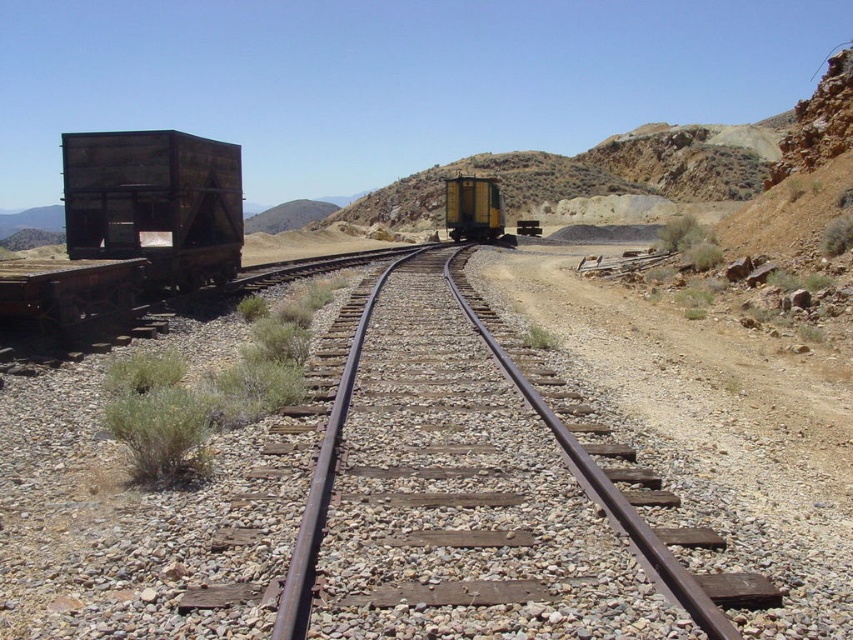
Consider the image. Is the position of weathered wood train car at left more distant than that of yellow matte train car at center?

No, it is not.

Between point (62, 296) and point (485, 228), which one is positioned behind?

The point (485, 228) is more distant.

This screenshot has width=853, height=640. In order to click on weathered wood train car at left in this screenshot , I will do `click(131, 228)`.

What do you see at coordinates (605, 490) in the screenshot? I see `rusty metal track at center` at bounding box center [605, 490].

Is rusty metal track at center positioned behind yellow matte train car at center?

That is False.

Is point (680, 593) positioned behind point (495, 195)?

No.

Where is `rusty metal track at center`? The width and height of the screenshot is (853, 640). rusty metal track at center is located at coordinates (605, 490).

Is weathered wood train car at left to the left of rusty metal track at center from the viewer's perspective?

Yes, weathered wood train car at left is to the left of rusty metal track at center.

The height and width of the screenshot is (640, 853). What do you see at coordinates (131, 228) in the screenshot? I see `weathered wood train car at left` at bounding box center [131, 228].

Which is in front, point (78, 296) or point (328, 461)?

Point (328, 461) is more forward.

Where is `weathered wood train car at left`? This screenshot has width=853, height=640. weathered wood train car at left is located at coordinates (131, 228).